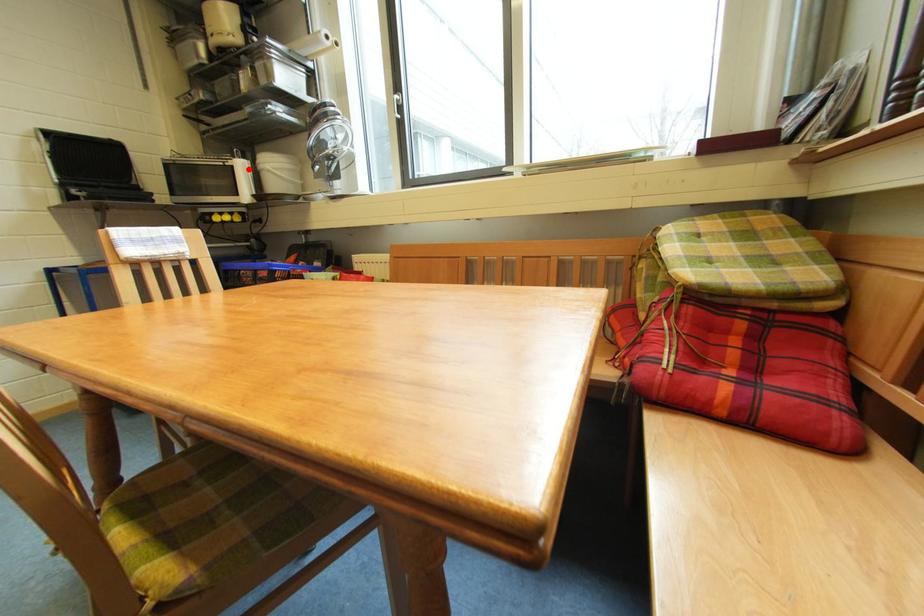
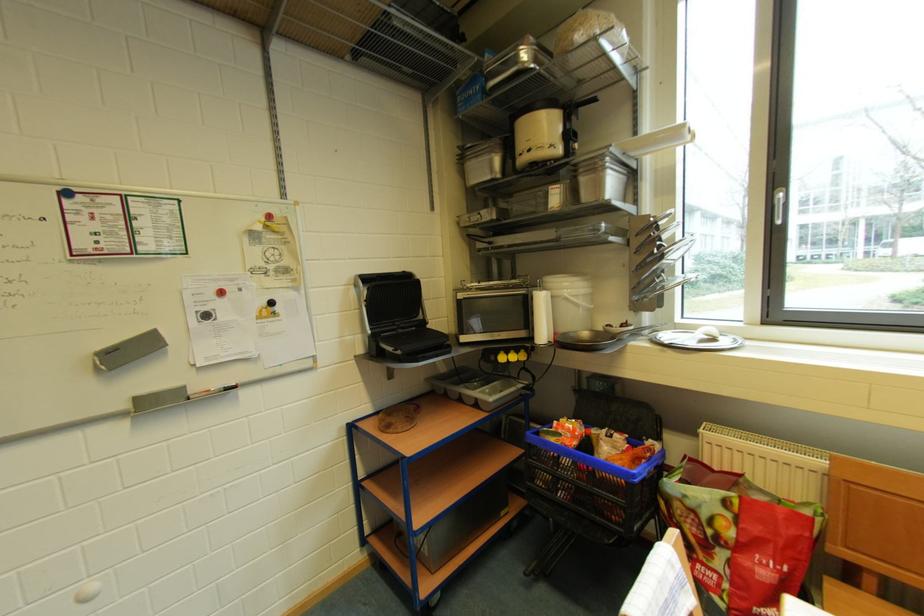
In the second image, find the point that corresponds to the highlighted location in the first image.

(548, 302)